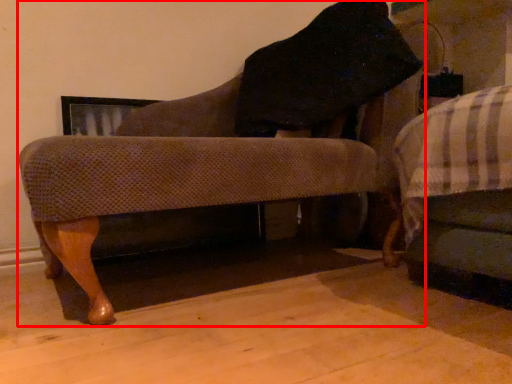
Question: From the image's perspective, where is chair (annotated by the red box) located in relation to furniture in the image?

Choices:
 (A) below
 (B) above

Answer: (B)